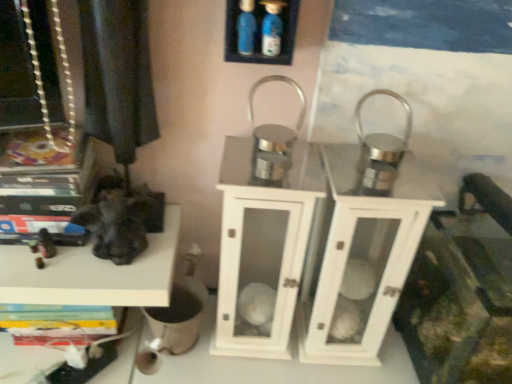
The width and height of the screenshot is (512, 384). I want to click on vacant region above black matte statue at left, which ranks as the second shelf in top-to-bottom order (from a real-world perspective), so click(76, 257).